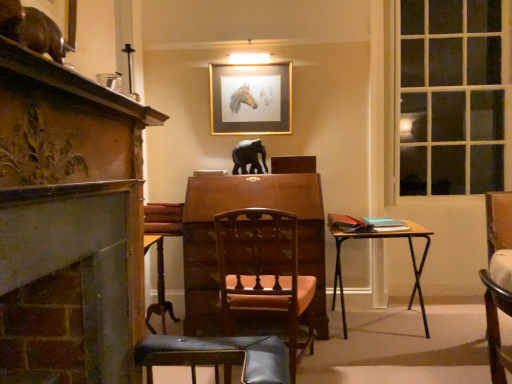
The image size is (512, 384). I want to click on free spot above carved wood fireplace at left (from a real-world perspective), so click(x=72, y=114).